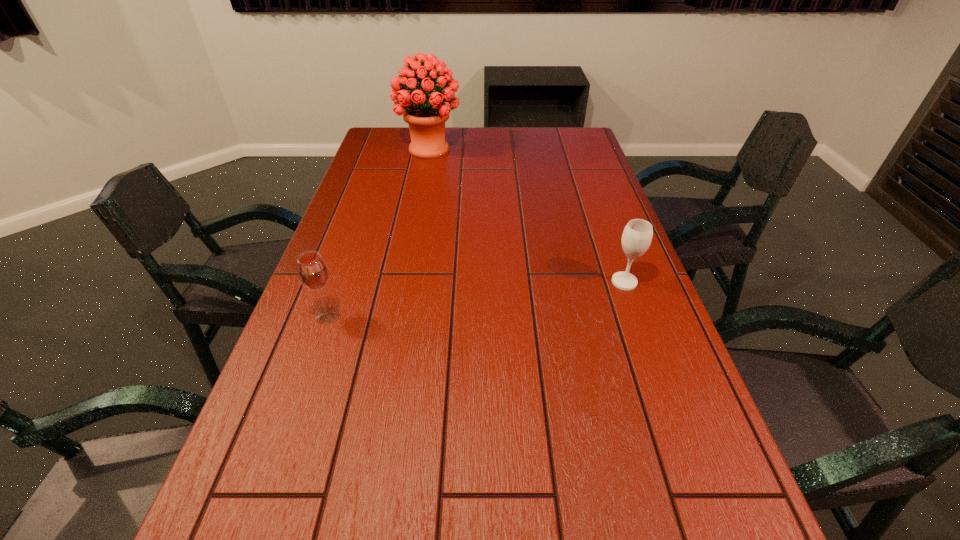
Where is `bouquet at the left edge`? The image size is (960, 540). bouquet at the left edge is located at coordinates (426, 111).

The width and height of the screenshot is (960, 540). In order to click on wineglass located in the left edge section of the desktop in this screenshot , I will do `click(312, 270)`.

I want to click on object that is at the right edge, so click(637, 235).

I want to click on object located in the far left corner section of the desktop, so click(x=426, y=111).

In the image, there is a desktop. Identify the location of vacant space at the far edge. (542, 133).

Identify the location of free spot at the left edge of the desktop. (248, 442).

This screenshot has width=960, height=540. In order to click on free space at the right edge of the desktop in this screenshot , I will do `click(594, 216)`.

Locate an element on the screen. vacant space at the far left corner of the desktop is located at coordinates (394, 148).

At what (x,y) coordinates should I click in order to perform the action: click on free spot at the far right corner of the desktop. Please return your answer as a coordinate pair (x, y). Looking at the image, I should click on (573, 147).

Where is `vacant area between the tallest object and the right wineglass`? The height and width of the screenshot is (540, 960). vacant area between the tallest object and the right wineglass is located at coordinates (527, 216).